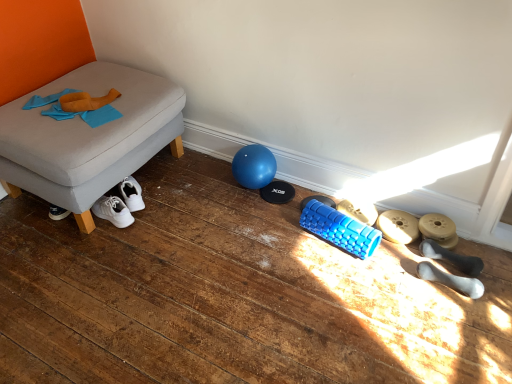
Identify the location of vacant area in front of matte gold dumbbell at lower right, positioned as the 3th footwear in back-to-front order. (467, 272).